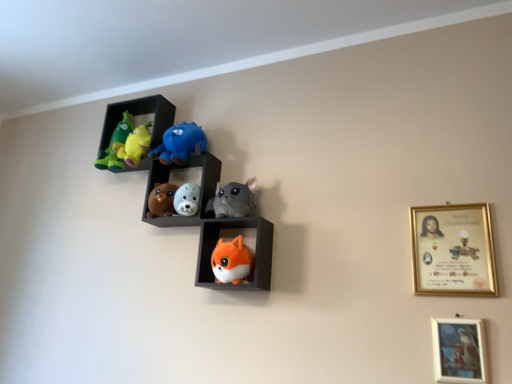
Question: Does gray plush cat at center, which appears as the 2th toy when viewed from the top, have a greater height compared to fluffy plush toys at center, arranged as the second shelf when viewed from the top?

Choices:
 (A) no
 (B) yes

Answer: (A)

Question: Does gray plush cat at center, which appears as the 2th toy when viewed from the top, appear on the right side of fluffy plush toys at center, marked as the 2th shelf in a bottom-to-top arrangement?

Choices:
 (A) no
 (B) yes

Answer: (B)

Question: Is gray plush cat at center, arranged as the fourth toy when ordered from the bottom, at the left side of fluffy plush toys at center, marked as the 2th shelf in a bottom-to-top arrangement?

Choices:
 (A) no
 (B) yes

Answer: (A)

Question: Is gray plush cat at center, which appears as the 2th toy when viewed from the top, not inside fluffy plush toys at center, arranged as the second shelf when viewed from the top?

Choices:
 (A) yes
 (B) no

Answer: (A)

Question: From the image's perspective, is gray plush cat at center, which appears as the 2th toy when viewed from the top, beneath fluffy plush toys at center, arranged as the second shelf when viewed from the top?

Choices:
 (A) no
 (B) yes

Answer: (B)

Question: Considering the positions of point (227, 210) and point (160, 135), is point (227, 210) closer or farther from the camera than point (160, 135)?

Choices:
 (A) farther
 (B) closer

Answer: (B)

Question: In terms of size, does gray plush cat at center, arranged as the fourth toy when ordered from the bottom, appear bigger or smaller than velvet plush toys at upper left, the 3th shelf in the bottom-to-top sequence?

Choices:
 (A) small
 (B) big

Answer: (A)

Question: Considering the positions of gray plush cat at center, which appears as the 2th toy when viewed from the top, and velvet plush toys at upper left, which is the first shelf from top to bottom, in the image, is gray plush cat at center, which appears as the 2th toy when viewed from the top, wider or thinner than velvet plush toys at upper left, which is the first shelf from top to bottom,?

Choices:
 (A) thin
 (B) wide

Answer: (A)

Question: From the image's perspective, is gray plush cat at center, arranged as the fourth toy when ordered from the bottom, located above or below velvet plush toys at upper left, which is the first shelf from top to bottom?

Choices:
 (A) below
 (B) above

Answer: (A)

Question: From a real-world perspective, relative to gold-framed painting at lower right, which ranks as the 1th picture frame in bottom-to-top order, is gold-framed certificate at upper right, the second picture frame from the bottom, vertically above or below?

Choices:
 (A) above
 (B) below

Answer: (A)

Question: Is point (435, 226) positioned closer to the camera than point (449, 345)?

Choices:
 (A) closer
 (B) farther

Answer: (B)

Question: Looking at the image, does gold-framed certificate at upper right, the second picture frame from the bottom, seem bigger or smaller compared to gold-framed painting at lower right, which ranks as the 1th picture frame in bottom-to-top order?

Choices:
 (A) small
 (B) big

Answer: (B)

Question: In terms of width, does gold-framed certificate at upper right, the second picture frame from the bottom, look wider or thinner when compared to gold-framed painting at lower right, which ranks as the 1th picture frame in bottom-to-top order?

Choices:
 (A) wide
 (B) thin

Answer: (A)

Question: Is fluffy white plush seal at center, which is counted as the second toy, starting from the bottom, inside the boundaries of velvet plush toys at upper left, which is the first shelf from top to bottom, or outside?

Choices:
 (A) outside
 (B) inside

Answer: (A)

Question: Considering the positions of fluffy white plush seal at center, which is counted as the second toy, starting from the bottom, and velvet plush toys at upper left, which is the first shelf from top to bottom, in the image, is fluffy white plush seal at center, which is counted as the second toy, starting from the bottom, taller or shorter than velvet plush toys at upper left, which is the first shelf from top to bottom,?

Choices:
 (A) tall
 (B) short

Answer: (B)